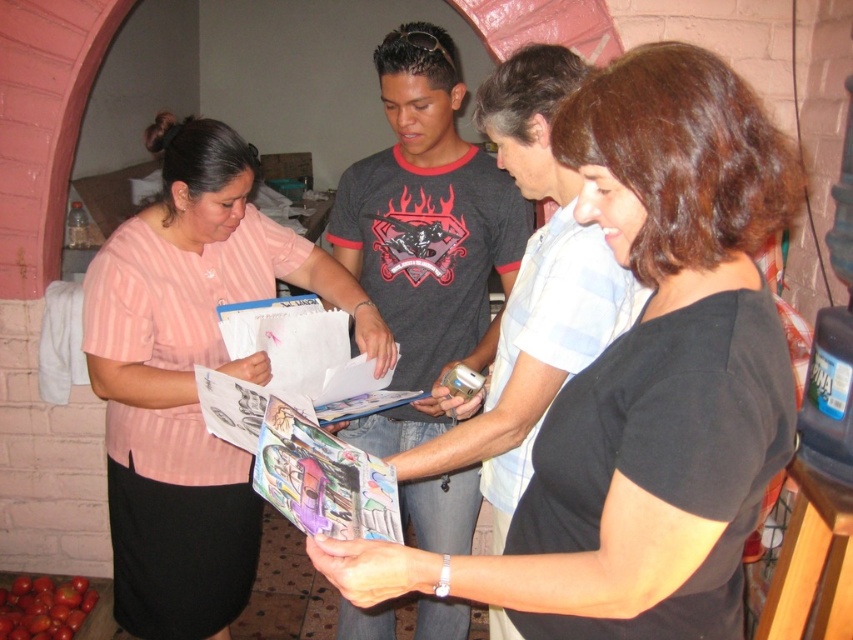
You are a photographer trying to capture a clear shot of the black matte shirt at center without the shiny red tomatoes at lower left blocking it. Can you adjust your position to achieve this?

The black matte shirt at center is in front of the shiny red tomatoes at lower left, so moving your position slightly backward or to the side might help avoid the tomatoes blocking the shirt in the photo.

You are part of this group and want to know who is shorter between the black matte shirt at center and the pink striped shirt at left. Can you determine this based on their positions?

The black matte shirt at center is not as tall as the pink striped shirt at left, so the black matte shirt at center is shorter.